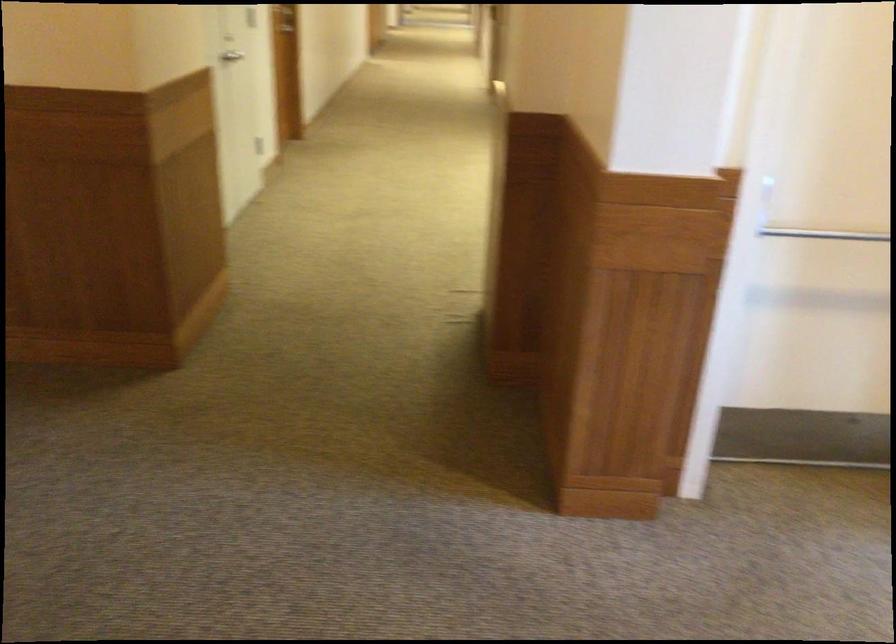
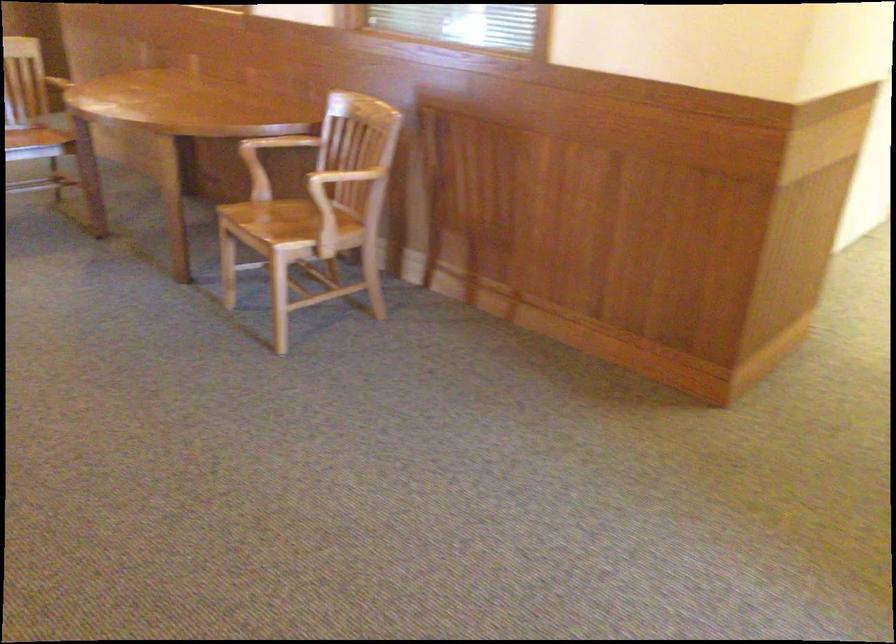
Question: The camera is either moving clockwise (left) or counter-clockwise (right) around the object. The first image is from the beginning of the video and the second image is from the end. Is the camera moving left or right when shooting the video?

Choices:
 (A) Left
 (B) Right

Answer: (B)